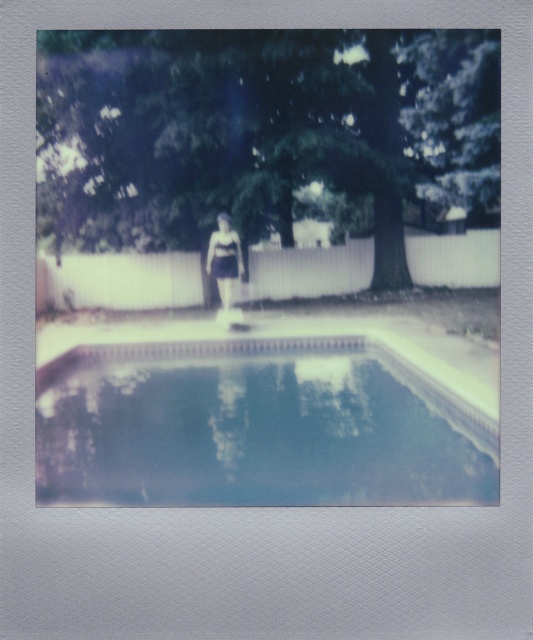
You are standing at the camera position and want to know the exact coordinates of the clear glass swimming pool at center. What are its coordinates?

The clear glass swimming pool at center is located at point [256,426].

You are a photographer trying to capture the clear glass swimming pool at center and the matte black swimsuit at center in a single shot. Based on their positions, which object should you focus on first to ensure both are in sharp focus?

The matte black swimsuit at center is above the clear glass swimming pool at center, so focusing on the swimsuit first will help ensure both are in focus as the pool is behind it.